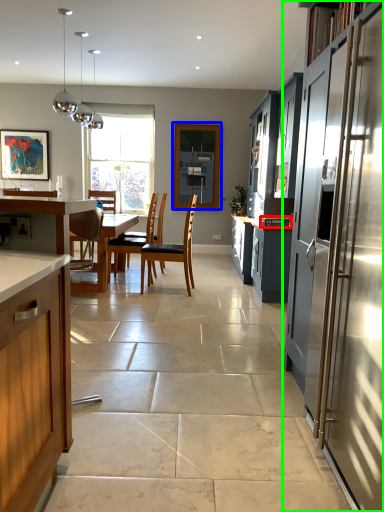
Question: Which is farther away from appliance (highlighted by a red box)? window screen (highlighted by a blue box) or cabinetry (highlighted by a green box)?

Choices:
 (A) window screen
 (B) cabinetry

Answer: (A)